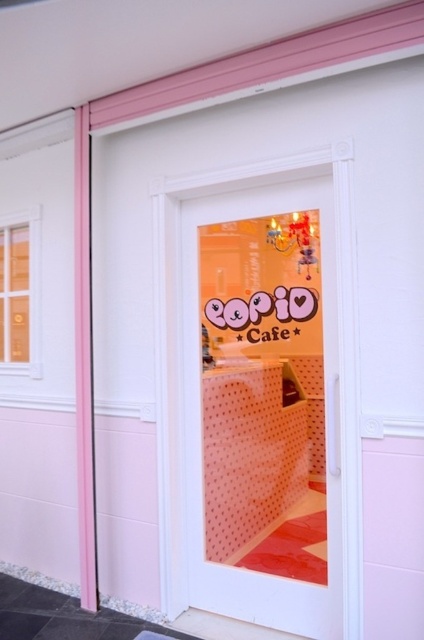
Is transparent glass door at center to the left of matte glass window at upper left from the viewer's perspective?

In fact, transparent glass door at center is to the right of matte glass window at upper left.

Can you confirm if transparent glass door at center is shorter than matte glass window at upper left?

In fact, transparent glass door at center may be taller than matte glass window at upper left.

Between point (158, 205) and point (30, 326), which one is positioned behind?

The point (30, 326) is more distant.

The height and width of the screenshot is (640, 424). I want to click on transparent glass door at center, so click(x=184, y=353).